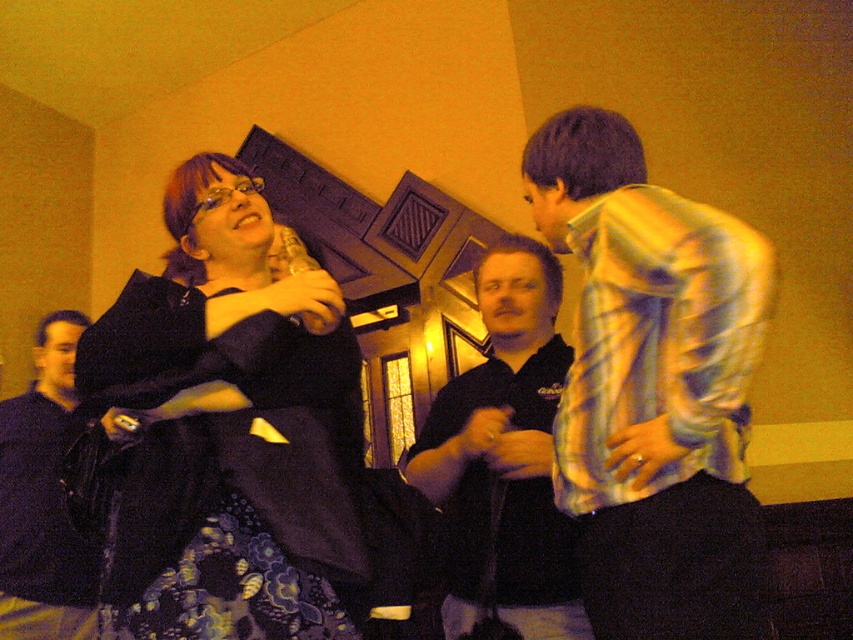
Is black shirt at center bigger than dark blue shirt at left?

Actually, black shirt at center might be smaller than dark blue shirt at left.

Who is more forward, (538, 284) or (57, 376)?

Point (538, 284) is more forward.

The width and height of the screenshot is (853, 640). I want to click on black shirt at center, so click(x=505, y=458).

Who is positioned more to the right, matte black dress at center or black shirt at center?

Positioned to the right is black shirt at center.

Between point (241, 314) and point (439, 429), which one is positioned behind?

Positioned behind is point (439, 429).

You are a GUI agent. You are given a task and a screenshot of the screen. Output one action in this format:
    pyautogui.click(x=<x>, y=<y>)
    Task: Click on the matte black dress at center
    
    Given the screenshot: What is the action you would take?
    pyautogui.click(x=231, y=428)

Locate an element on the screen. This screenshot has height=640, width=853. matte black dress at center is located at coordinates (231, 428).

This screenshot has width=853, height=640. Describe the element at coordinates (653, 387) in the screenshot. I see `light blue satin shirt at right` at that location.

This screenshot has width=853, height=640. What do you see at coordinates (653, 387) in the screenshot? I see `light blue satin shirt at right` at bounding box center [653, 387].

Identify the location of light blue satin shirt at right. This screenshot has width=853, height=640. (653, 387).